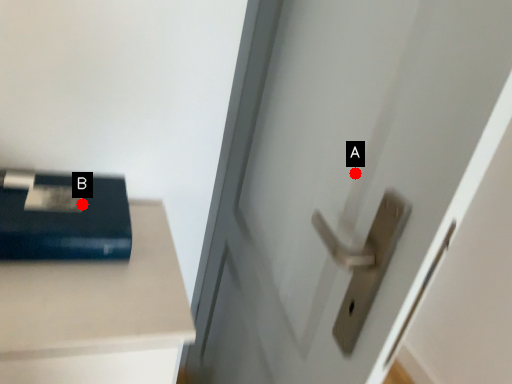
Question: Two points are circled on the image, labeled by A and B beside each circle. Which of the following is the closest to the observer?

Choices:
 (A) A is closer
 (B) B is closer

Answer: (A)